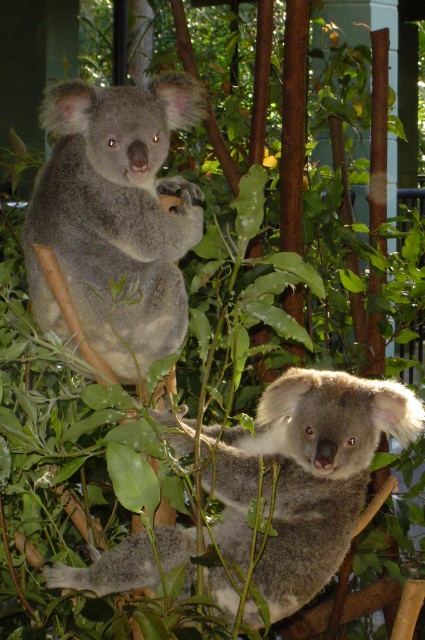
What are the coordinates of the gray furry koala at upper left?

The gray furry koala at upper left is located at coordinates point (116, 216).

You are a zookeeper trying to locate two koalas in the exhibit. Which direction should you look from the fuzzy gray koala at center to find the gray furry koala at upper left?

You should look to the left from the fuzzy gray koala at center to find the gray furry koala at upper left because the gray furry koala at upper left is positioned to the left of the fuzzy gray koala at center.